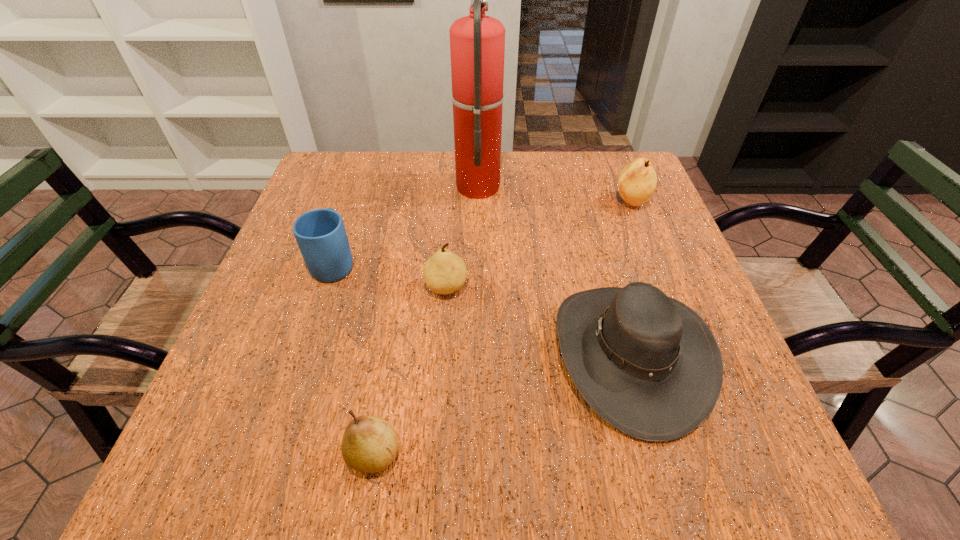
Find the location of a particular element. This screenshot has height=540, width=960. blank region between the tallest object and the mug is located at coordinates click(406, 224).

At what (x,y) coordinates should I click in order to perform the action: click on object that is the fourth closest one to the rightmost pear. Please return your answer as a coordinate pair (x, y). Looking at the image, I should click on point(320,234).

At what (x,y) coordinates should I click in order to perform the action: click on object that can be found as the fourth closest to the fire extinguisher. Please return your answer as a coordinate pair (x, y). Looking at the image, I should click on click(x=646, y=363).

Identify the location of pear that is the second closest one to the shortest pear. (637, 181).

Find the location of `pear that is the third closest to the leftmost object`. pear that is the third closest to the leftmost object is located at coordinates (637, 181).

Identify the location of free location that satisfies the following two spatial constraints: 1. with the nozzle and gauge on the rightmost pear; 2. on the right side of the fire extinguisher. This screenshot has width=960, height=540. (478, 202).

I want to click on free spot that satisfies the following two spatial constraints: 1. on the side of the farthest pear with the handle; 2. on the right side of the leftmost object, so click(354, 202).

Image resolution: width=960 pixels, height=540 pixels. I want to click on vacant position in the image that satisfies the following two spatial constraints: 1. on the side of the rightmost pear with the handle; 2. on the left side of the mug, so click(x=354, y=202).